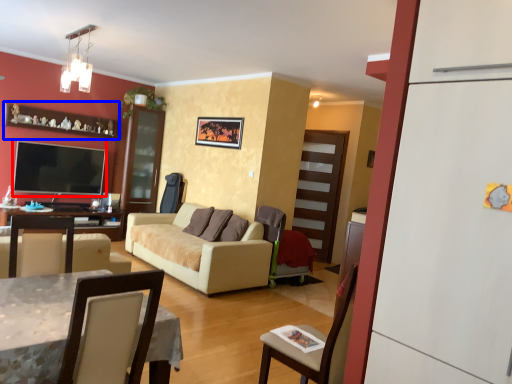
Question: Which object appears closest to the camera in this image, television (highlighted by a red box) or shelf (highlighted by a blue box)?

Choices:
 (A) television
 (B) shelf

Answer: (B)